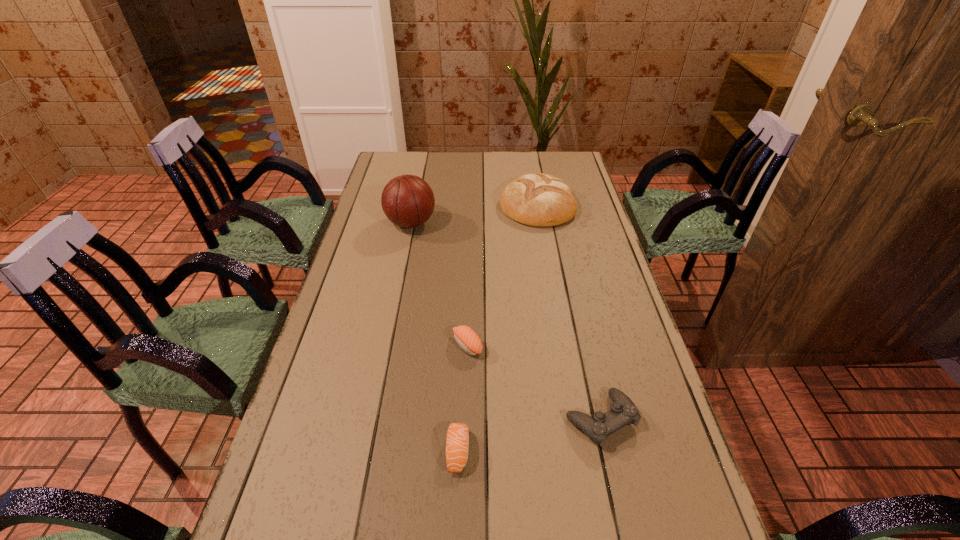
The height and width of the screenshot is (540, 960). I want to click on empty location between the tallest object and the control, so click(x=506, y=321).

The width and height of the screenshot is (960, 540). Identify the location of free space between the shortest object and the leftmost object. (434, 337).

The image size is (960, 540). Identify the location of vacant space in between the control and the shorter sushi. (529, 435).

Image resolution: width=960 pixels, height=540 pixels. Identify the location of vacant point located between the taller sushi and the fourth shortest object. (502, 275).

Where is `vacant point located between the shorter sushi and the bread`? This screenshot has height=540, width=960. vacant point located between the shorter sushi and the bread is located at coordinates (497, 328).

You are a GUI agent. You are given a task and a screenshot of the screen. Output one action in this format:
    pyautogui.click(x=<x>, y=<y>)
    Task: Click on the empty space that is in between the third nearest object and the fourth shortest object
    This screenshot has width=960, height=540.
    Given the screenshot: What is the action you would take?
    pyautogui.click(x=502, y=275)

The image size is (960, 540). I want to click on vacant space in between the bread and the control, so click(569, 312).

Image resolution: width=960 pixels, height=540 pixels. In order to click on vacant area that lies between the third farthest object and the nearer sushi in this screenshot , I will do `click(463, 398)`.

You are a GUI agent. You are given a task and a screenshot of the screen. Output one action in this format:
    pyautogui.click(x=<x>, y=<y>)
    Task: Click on the vacant area between the shorter sushi and the taller sushi
    
    Given the screenshot: What is the action you would take?
    pyautogui.click(x=463, y=398)

The width and height of the screenshot is (960, 540). Find the location of `free point between the bread and the tallest object`. free point between the bread and the tallest object is located at coordinates (474, 214).